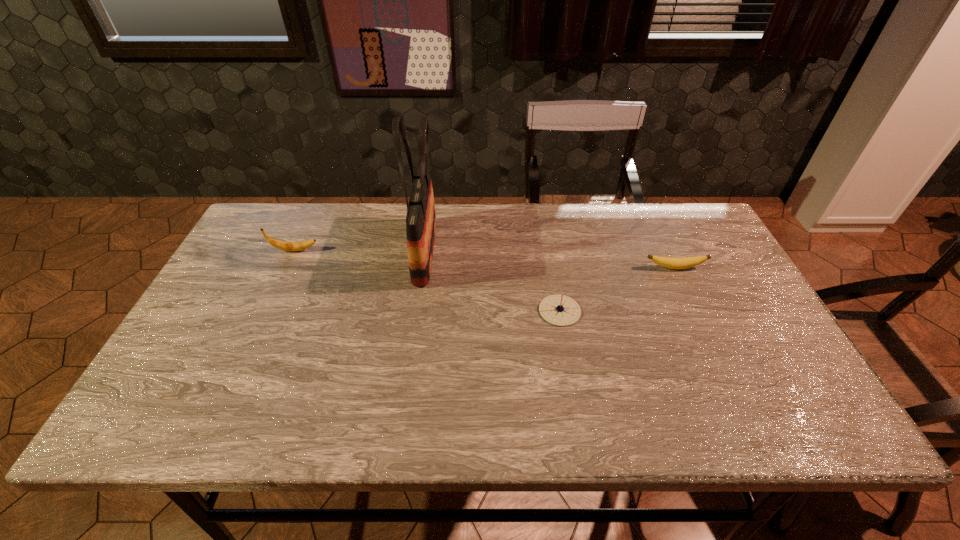
Find the location of a particular element. The height and width of the screenshot is (540, 960). free region located 0.220m on the front of the nearest object is located at coordinates (576, 406).

You are a GUI agent. You are given a task and a screenshot of the screen. Output one action in this format:
    pyautogui.click(x=<x>, y=<y>)
    Task: Click on the free space located on the front of the shortest object
    The width and height of the screenshot is (960, 540).
    Given the screenshot: What is the action you would take?
    pyautogui.click(x=714, y=352)

Locate an element on the screen. Image resolution: width=960 pixels, height=540 pixels. shopping bag that is positioned at the far edge is located at coordinates (421, 219).

At what (x,y) coordinates should I click in order to perform the action: click on banana present at the far edge. Please return your answer as a coordinate pair (x, y). The height and width of the screenshot is (540, 960). Looking at the image, I should click on (282, 245).

Image resolution: width=960 pixels, height=540 pixels. Find the location of `object situated at the left edge`. object situated at the left edge is located at coordinates (282, 245).

Where is `object at the right edge`? object at the right edge is located at coordinates (669, 262).

Where is `object that is at the far left corner`? This screenshot has width=960, height=540. object that is at the far left corner is located at coordinates (282, 245).

Where is `blank space at the far edge of the desktop`? This screenshot has height=540, width=960. blank space at the far edge of the desktop is located at coordinates (444, 207).

Locate an element on the screen. Image resolution: width=960 pixels, height=540 pixels. vacant space at the near edge is located at coordinates (276, 413).

The image size is (960, 540). I want to click on vacant area at the left edge of the desktop, so 207,348.